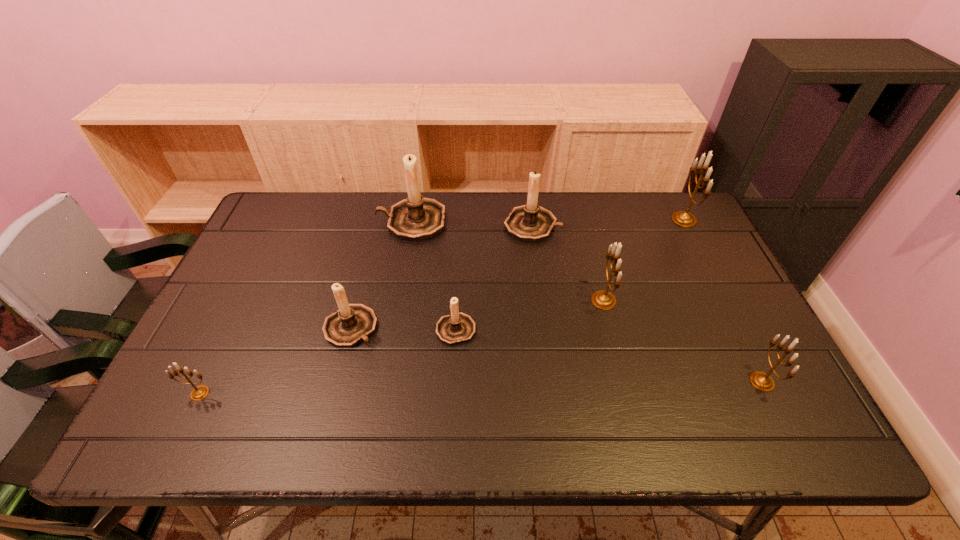
Find the location of a particular element. This screenshot has height=540, width=960. the closest brown candle holder to the third gold candelabrum from right to left is located at coordinates (530, 222).

Choose which brown candle holder is the second nearest neighbor to the third biggest brown candle holder. Please provide its 2D coordinates. Your answer should be formatted as a tuple, i.e. [(x, y)], where the tuple contains the x and y coordinates of a point satisfying the conditions above.

[(415, 218)]

In order to click on gold candelabrum that stands as the third closest to the leftmost candelabrum in this screenshot , I will do `click(681, 218)`.

You are a GUI agent. You are given a task and a screenshot of the screen. Output one action in this format:
    pyautogui.click(x=<x>, y=<y>)
    Task: Click on the fourth closest gold candelabrum relative to the biggest brown candle holder
    
    Given the screenshot: What is the action you would take?
    pyautogui.click(x=762, y=381)

Where is `blank space that satisfies the following two spatial constraints: 1. on the back side of the leftmost gold candelabrum; 2. on the right side of the second biggest brown candle holder`? The width and height of the screenshot is (960, 540). blank space that satisfies the following two spatial constraints: 1. on the back side of the leftmost gold candelabrum; 2. on the right side of the second biggest brown candle holder is located at coordinates (282, 225).

Identify the location of vacant region that satisfies the following two spatial constraints: 1. on the back side of the leftmost gold candelabrum; 2. on the left side of the biggest brown candle holder. Image resolution: width=960 pixels, height=540 pixels. (284, 221).

The image size is (960, 540). I want to click on free spot that satisfies the following two spatial constraints: 1. on the front side of the fifth candelabrum from left to right; 2. on the right side of the biggest brown candle holder, so (411, 225).